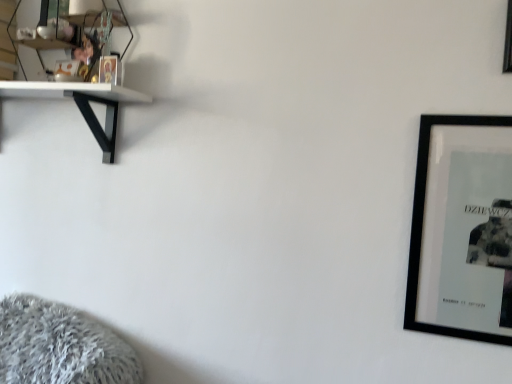
Question: Is point (507, 41) positioned closer to the camera than point (51, 11)?

Choices:
 (A) farther
 (B) closer

Answer: (B)

Question: Is black matte picture frame at upper right, acting as the second picture frame starting from the bottom, bigger or smaller than clear glass shelf at upper left?

Choices:
 (A) big
 (B) small

Answer: (B)

Question: Which object is the closest to the black matte picture frame at right, positioned as the first picture frame in bottom-to-top order?

Choices:
 (A) black matte picture frame at upper right, which is the 1th picture frame in top-to-bottom order
 (B) clear glass shelf at upper left

Answer: (A)

Question: Estimate the real-world distances between objects in this image. Which object is farther from the black matte picture frame at right, positioned as the first picture frame in bottom-to-top order?

Choices:
 (A) clear glass shelf at upper left
 (B) black matte picture frame at upper right, acting as the second picture frame starting from the bottom

Answer: (A)